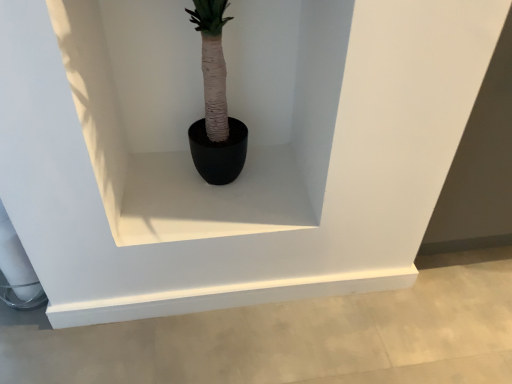
Locate an element on the screen. blank space above white matte window sill at center (from a real-world perspective) is located at coordinates (220, 192).